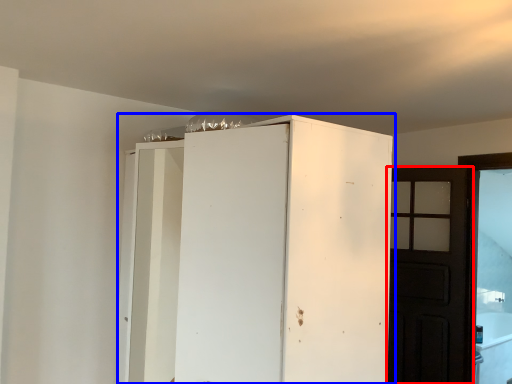
Question: Which object appears closest to the camera in this image, door (highlighted by a red box) or cupboard (highlighted by a blue box)?

Choices:
 (A) door
 (B) cupboard

Answer: (B)